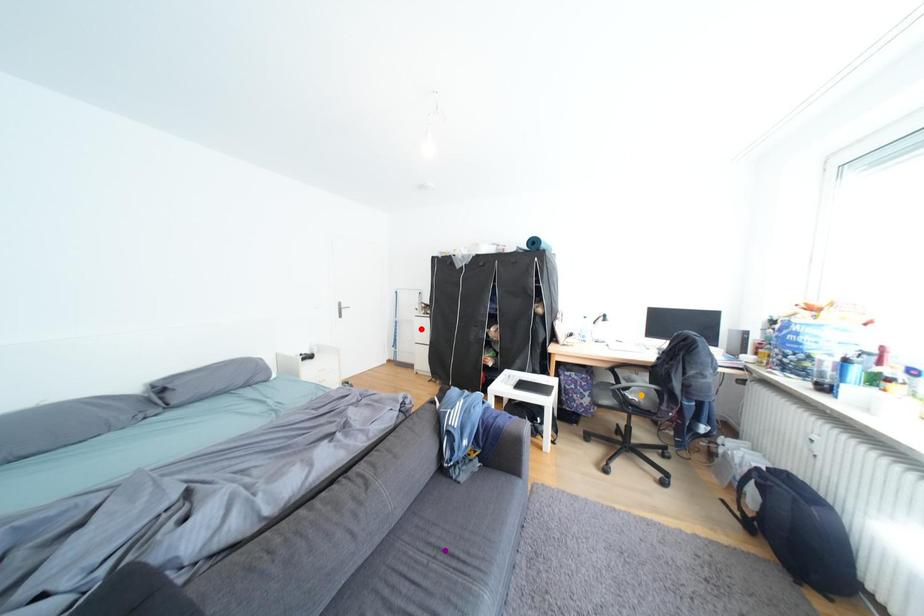
Order these from farthest to nearest:
orange point | purple point | red point

red point < orange point < purple point